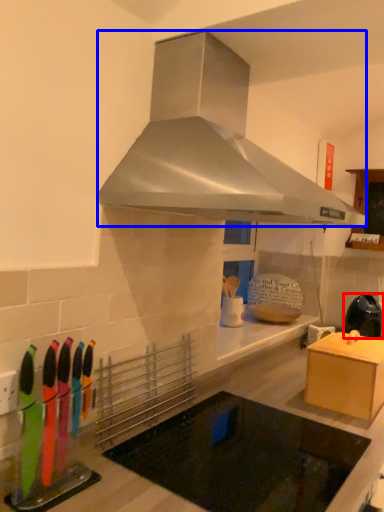
Question: Which point is closer to the camera, kitchen appliance (highlighted by a red box) or home appliance (highlighted by a blue box)?

Choices:
 (A) kitchen appliance
 (B) home appliance

Answer: (B)